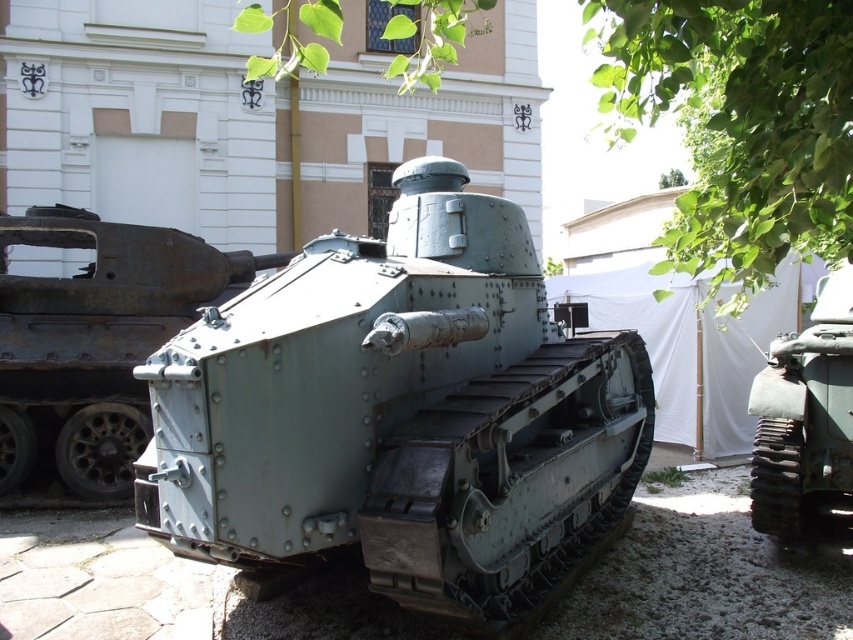
You are a visitor at a military museum and notice the green leafy tree at upper center and the green matte tank at right. Which object is taller when viewed from the front?

The green leafy tree at upper center is taller than the green matte tank at right.

You are standing in front of the vintage military tank exhibit. There are two points marked on the tank, one at coordinate point [718,228] and the other at point [10,380]. Which point is closer to you?

Point [718,228] is closer to the viewer than point [10,380].

You are a tour guide explaining the layout of the museum exhibit. You mention both the matte green tank at center and the green matte tank at right. Which tank is closer to the entrance where visitors first arrive?

The matte green tank at center is closer to the entrance where visitors first arrive because it is positioned in front of the green matte tank at right.